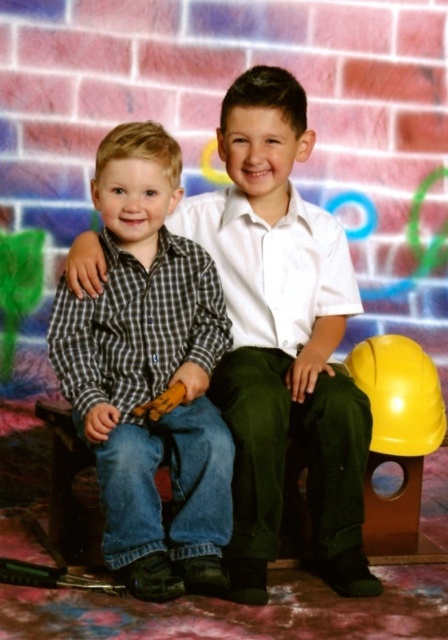
You are standing in front of the image and want to touch the checkered fabric shirt at center and the checkered fabric shirt at left. Which one would you reach first?

The checkered fabric shirt at center is closer to you than the checkered fabric shirt at left, so you would reach the checkered fabric shirt at center first.